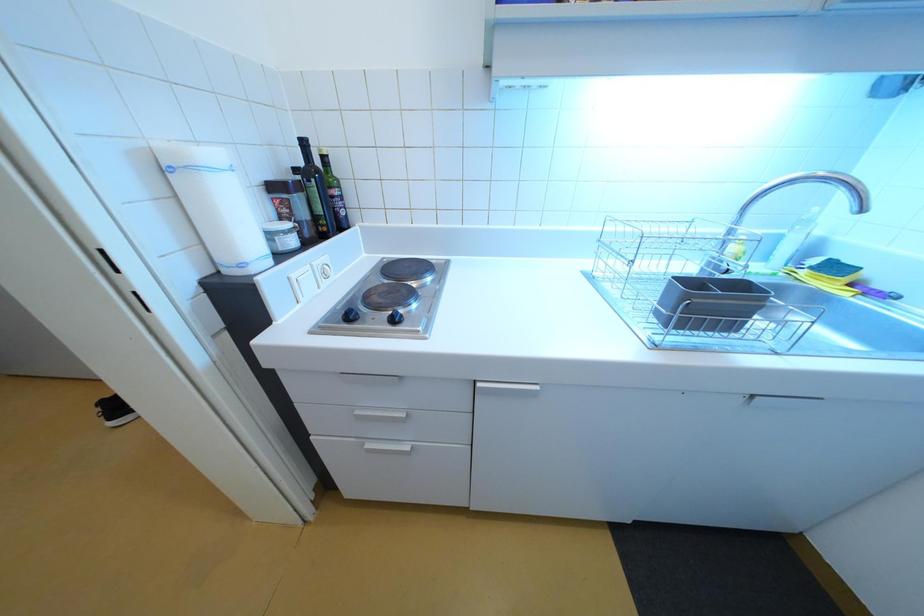
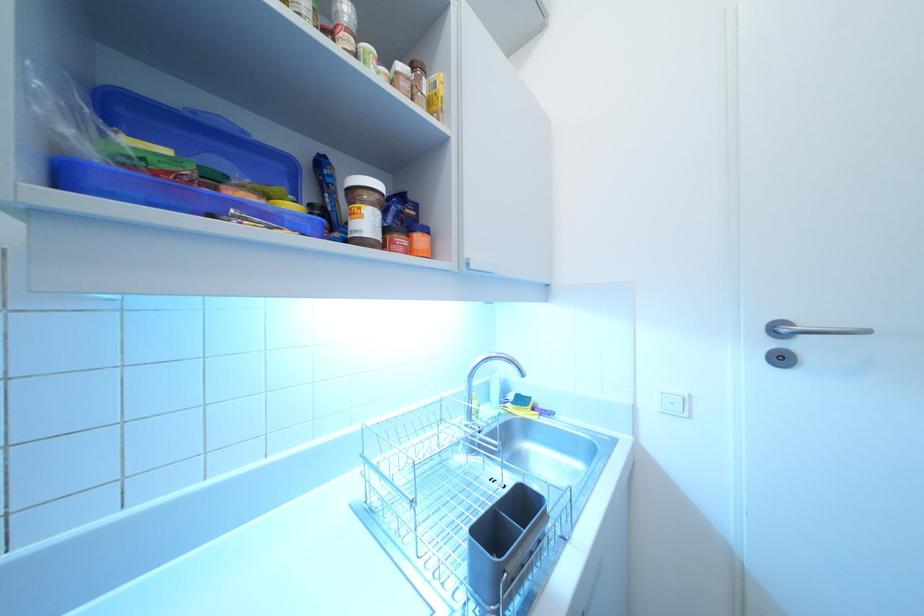
Looking at this image, based on the continuous images, in which direction is the camera rotating?

The camera's rotation is toward right-up.